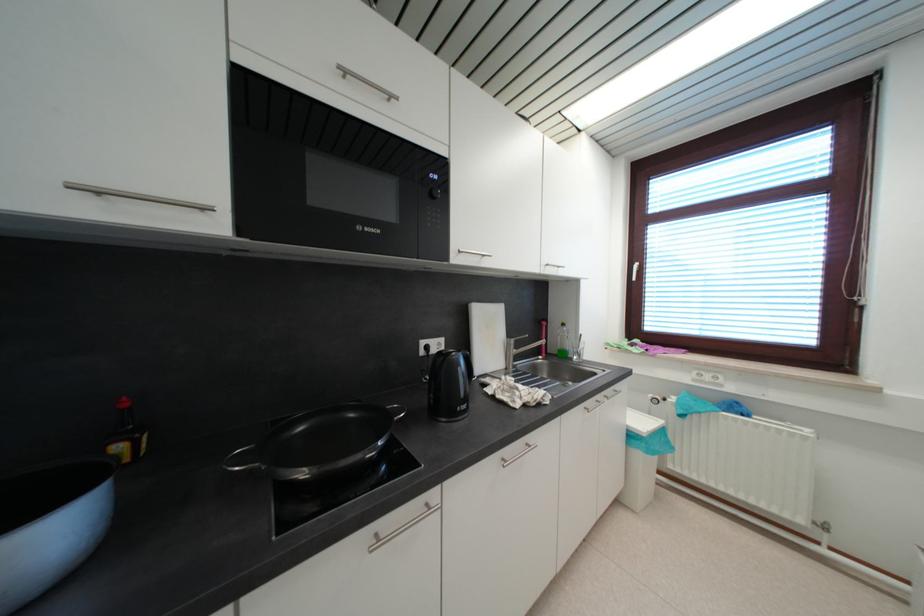
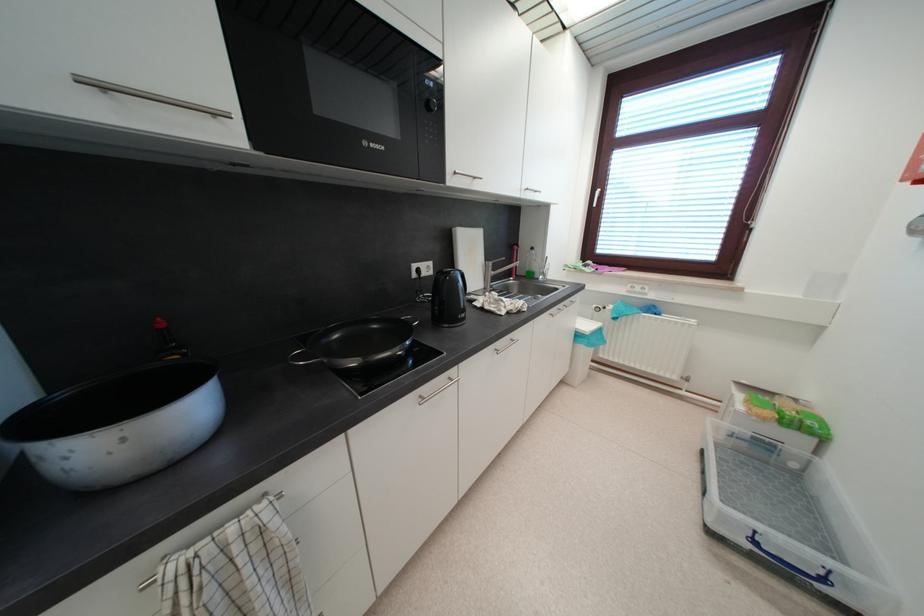
Where in the second image is the point corresponding to the point at 553,267 from the first image?

(532, 192)